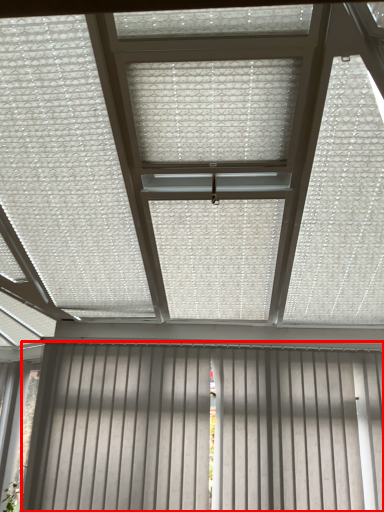
Question: From the image's perspective, what is the correct spatial positioning of garage door (annotated by the red box) in reference to blind?

Choices:
 (A) above
 (B) below

Answer: (B)